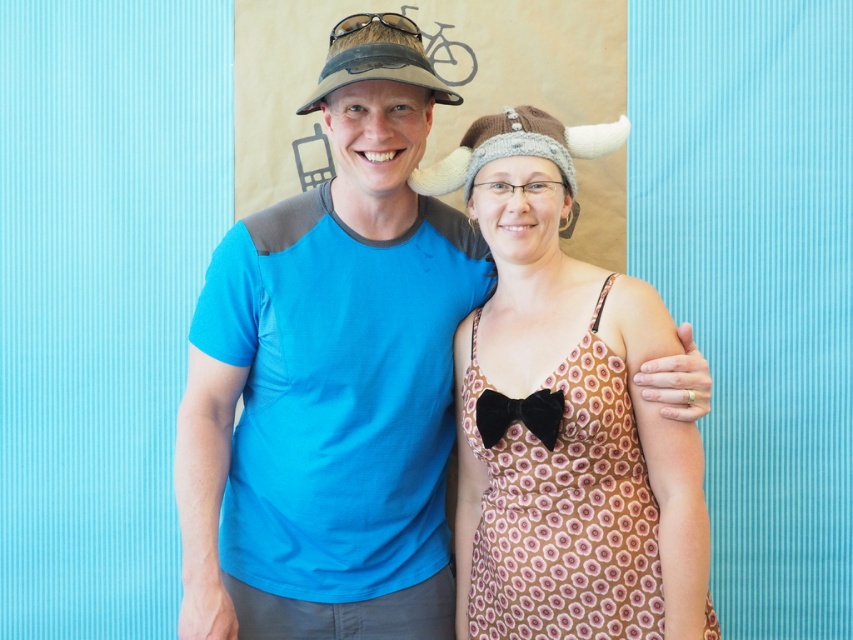
Which is above, brown fabric hat at upper center or velvet black bow tie at center?

brown fabric hat at upper center is above.

Who is more forward, (341, 58) or (480, 408)?

Point (341, 58) is in front.

Which is in front, point (347, 22) or point (550, 444)?

Point (550, 444) is more forward.

This screenshot has width=853, height=640. I want to click on brown fabric hat at upper center, so click(376, 58).

Is point (384, 531) in front of point (488, 403)?

No, it is behind (488, 403).

Based on the photo, does blue cotton t-shirt at left have a larger size compared to velvet black bow tie at center?

Indeed, blue cotton t-shirt at left has a larger size compared to velvet black bow tie at center.

Identify the location of blue cotton t-shirt at left. This screenshot has height=640, width=853. (332, 378).

Who is positioned more to the left, knitted woolen hat at center or velvet black bow tie at center?

Positioned to the left is velvet black bow tie at center.

Does point (457, 172) lie behind point (506, 397)?

Yes, point (457, 172) is behind point (506, 397).

In the scene shown: Measure the distance between point (445, 166) and camera.

Point (445, 166) and camera are 2.20 meters apart.

Identify the location of knitted woolen hat at center. This screenshot has height=640, width=853. (518, 147).